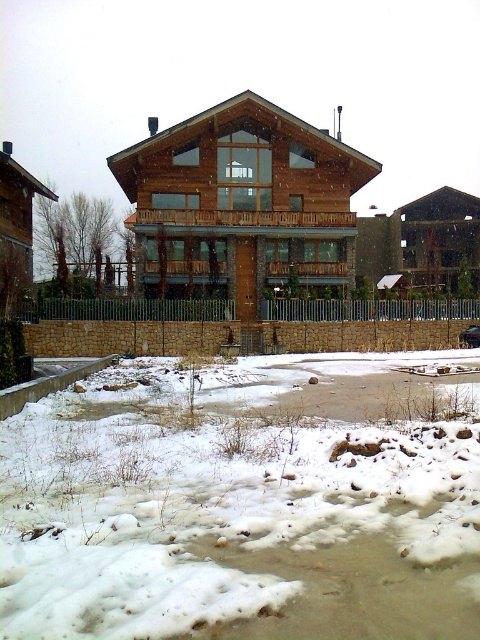
Is white fluffy snow at lower center taller than shiny black car at center?

In fact, white fluffy snow at lower center may be shorter than shiny black car at center.

Between point (146, 563) and point (476, 336), which one is positioned behind?

Point (476, 336)

You are a GUI agent. You are given a task and a screenshot of the screen. Output one action in this format:
    pyautogui.click(x=<x>, y=<y>)
    Task: Click on the white fluffy snow at lower center
    The image size is (480, 640).
    Given the screenshot: What is the action you would take?
    pyautogui.click(x=240, y=508)